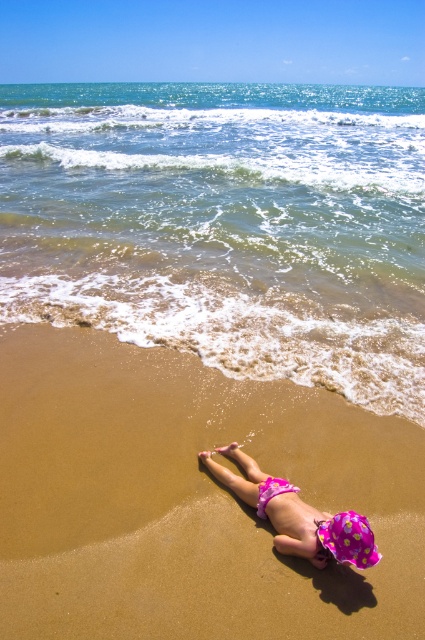
Question: Does clear blue water at upper center appear on the left side of brown sandy beach at lower center?

Choices:
 (A) yes
 (B) no

Answer: (B)

Question: Can you confirm if clear blue water at upper center is positioned to the left of pink fabric stomach at lower center?

Choices:
 (A) no
 (B) yes

Answer: (B)

Question: Among these objects, which one is nearest to the camera?

Choices:
 (A) clear blue water at upper center
 (B) brown sandy beach at lower center
 (C) pink polka dot swim cap at lower center

Answer: (B)

Question: Which point is closer to the camera?

Choices:
 (A) (272, 506)
 (B) (286, 490)
 (C) (62, 166)
 (D) (212, 516)

Answer: (A)

Question: Estimate the real-world distances between objects in this image. Which object is farther from the clear blue water at upper center?

Choices:
 (A) pink polka dot swim cap at lower center
 (B) pink fabric stomach at lower center

Answer: (A)

Question: Does pink polka dot swim cap at lower center appear on the left side of pink fabric stomach at lower center?

Choices:
 (A) yes
 (B) no

Answer: (B)